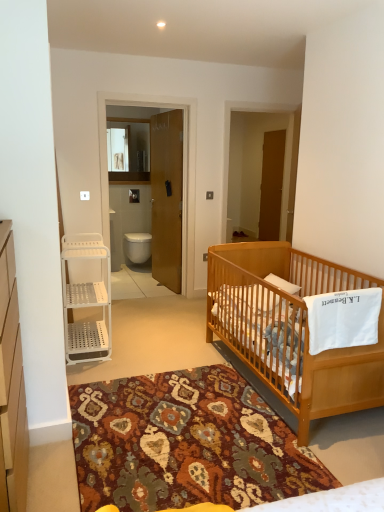
Where is `vacant space to the right of white plastic shelf at left`? The image size is (384, 512). vacant space to the right of white plastic shelf at left is located at coordinates (139, 347).